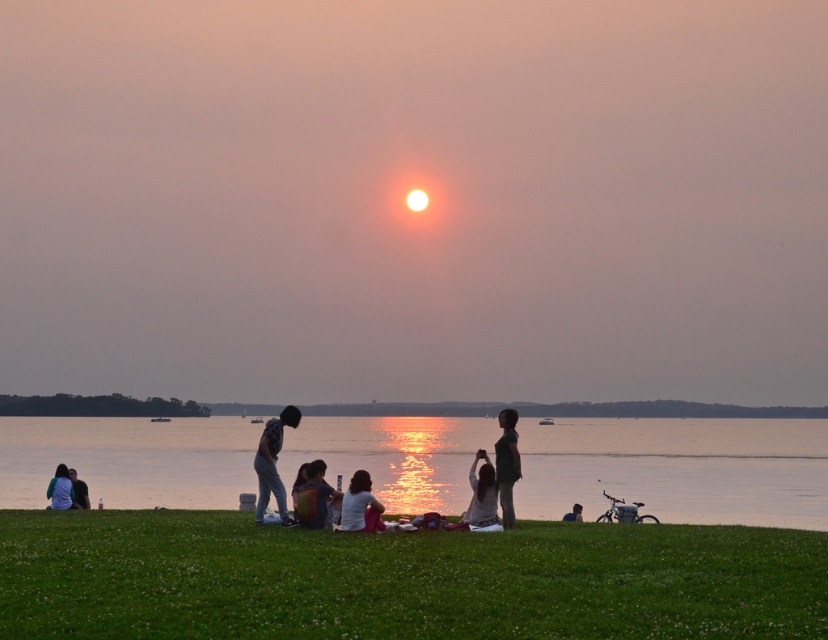
Question: Is the position of dark gray jeans at center less distant than that of matte gray shirt at center?

Choices:
 (A) yes
 (B) no

Answer: (B)

Question: Is reflective water at center smaller than blue denim jeans at lower right?

Choices:
 (A) no
 (B) yes

Answer: (A)

Question: Among these points, which one is nearest to the camera?

Choices:
 (A) (817, 515)
 (B) (357, 524)
 (C) (186, 588)
 (D) (84, 492)

Answer: (C)

Question: Which object is positioned farthest from the matte gray shirt at center?

Choices:
 (A) reflective water at center
 (B) dark gray sweater at lower left

Answer: (A)

Question: Is green grassy field at lower center below dark green fabric shirt at center?

Choices:
 (A) yes
 (B) no

Answer: (A)

Question: Which of the following is the closest to the observer?

Choices:
 (A) green grassy field at lower center
 (B) dark green fabric shirt at center
 (C) blue denim jeans at lower right
 (D) dark gray sweater at lower left

Answer: (A)